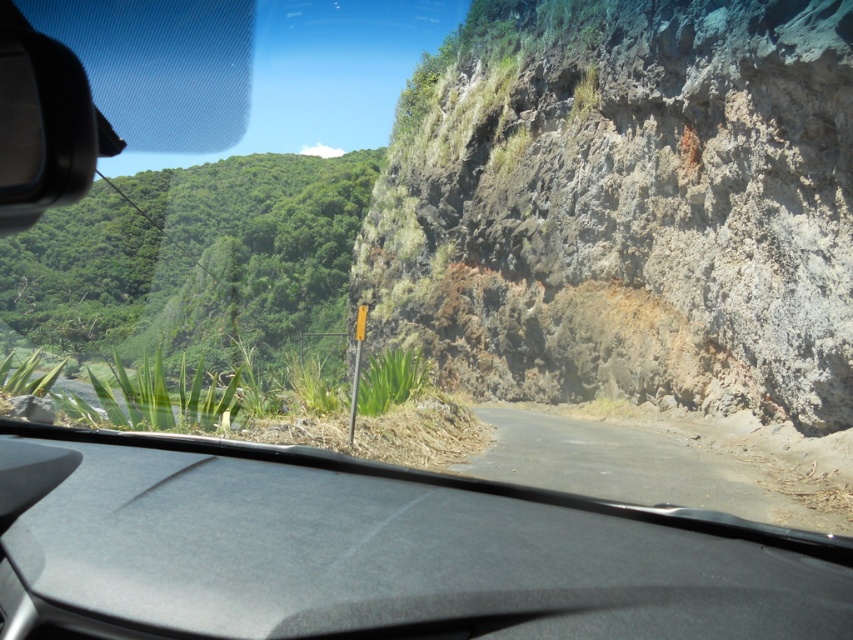
Question: From the image, what is the correct spatial relationship of black matte dashboard at center in relation to dirt road at lower right?

Choices:
 (A) above
 (B) below

Answer: (A)

Question: Which point is farther from the camera taking this photo?

Choices:
 (A) (605, 365)
 (B) (258, 570)

Answer: (A)

Question: Which object is farther from the camera taking this photo?

Choices:
 (A) dirt road at lower right
 (B) rusty rock cliff at right

Answer: (B)

Question: Can you confirm if rusty rock cliff at right is positioned above dirt road at lower right?

Choices:
 (A) no
 (B) yes

Answer: (B)

Question: Can you confirm if black matte dashboard at center is wider than dirt road at lower right?

Choices:
 (A) no
 (B) yes

Answer: (A)

Question: Which object appears farthest from the camera in this image?

Choices:
 (A) dirt road at lower right
 (B) rusty rock cliff at right
 (C) black matte dashboard at center

Answer: (B)